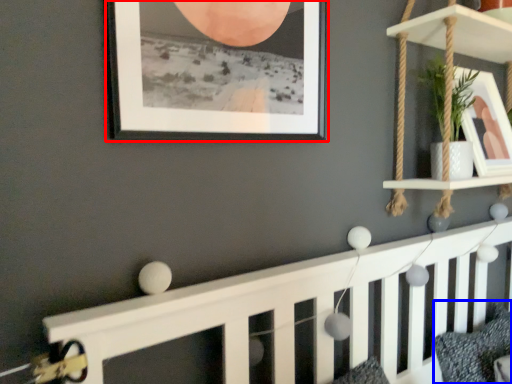
Question: Among these objects, which one is farthest to the camera, picture frame (highlighted by a red box) or pillow (highlighted by a blue box)?

Choices:
 (A) picture frame
 (B) pillow

Answer: (B)